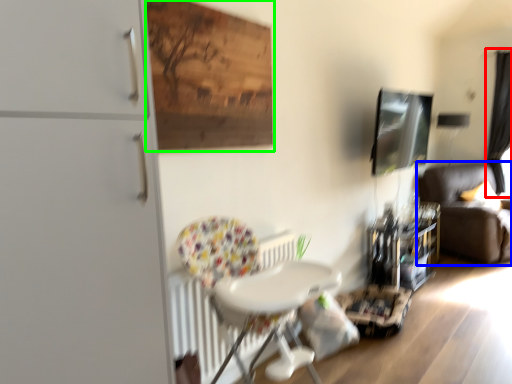
Question: Estimate the real-world distances between objects in this image. Which object is farther from curtain (highlighted by a red box), studio couch (highlighted by a blue box) or plywood (highlighted by a green box)?

Choices:
 (A) studio couch
 (B) plywood

Answer: (B)